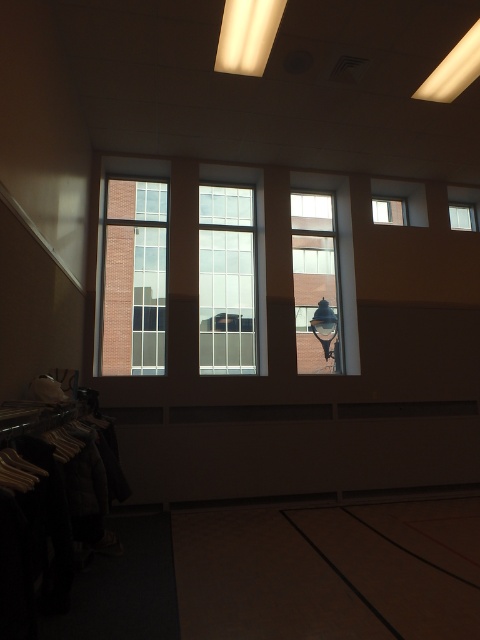
Between matte glass window at center and transparent glass window at upper right, which one is positioned higher?

transparent glass window at upper right is higher up.

Between point (303, 280) and point (450, 220), which one is positioned behind?

Point (450, 220)

Is point (331, 241) farther from viewer compared to point (472, 211)?

No, it is in front of (472, 211).

You are a GUI agent. You are given a task and a screenshot of the screen. Output one action in this format:
    pyautogui.click(x=<x>, y=<y>)
    Task: Click on the matte glass window at center
    This screenshot has width=480, height=640.
    Given the screenshot: What is the action you would take?
    pyautogui.click(x=315, y=282)

Can you confirm if matte glass window at center is positioned below clear glass window at left?

Yes.

Looking at this image, is matte glass window at center closer to camera compared to clear glass window at left?

No, matte glass window at center is behind clear glass window at left.

Is point (323, 332) positioned before point (151, 310)?

That is False.

Where is `matte glass window at center`? This screenshot has width=480, height=640. matte glass window at center is located at coordinates (315, 282).

Does clear glass window at center appear under matte glass window at center?

Incorrect, clear glass window at center is not positioned below matte glass window at center.

Based on the photo, who is shorter, clear glass window at center or matte glass window at center?

With less height is matte glass window at center.

Identify the location of clear glass window at center. pyautogui.click(x=227, y=280).